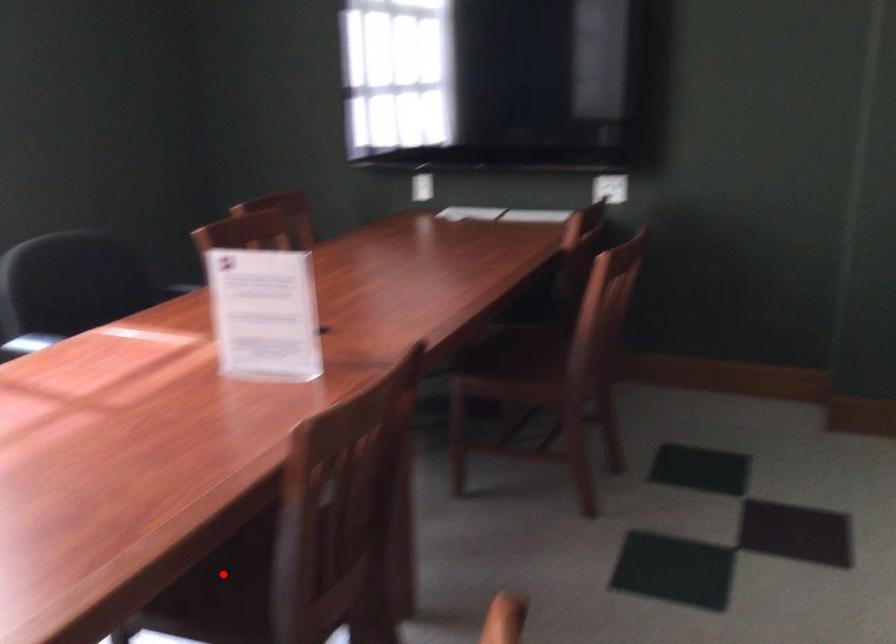
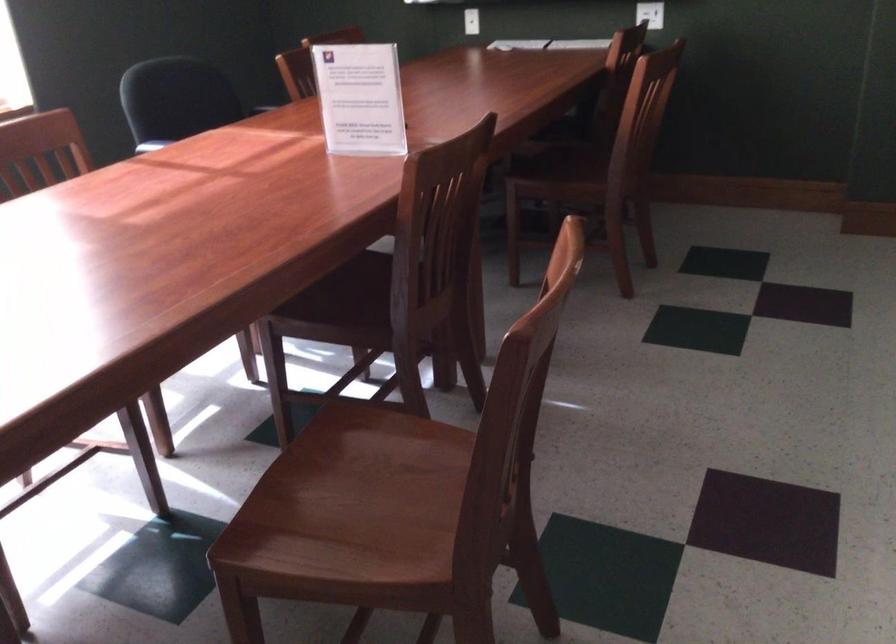
Question: I am providing you with two images of the same scene from different viewpoints. In image1, a red point is highlighted. Considering the same 3D point in image2, which of the following is correct?

Choices:
 (A) It is closer
 (B) It is farther

Answer: (B)